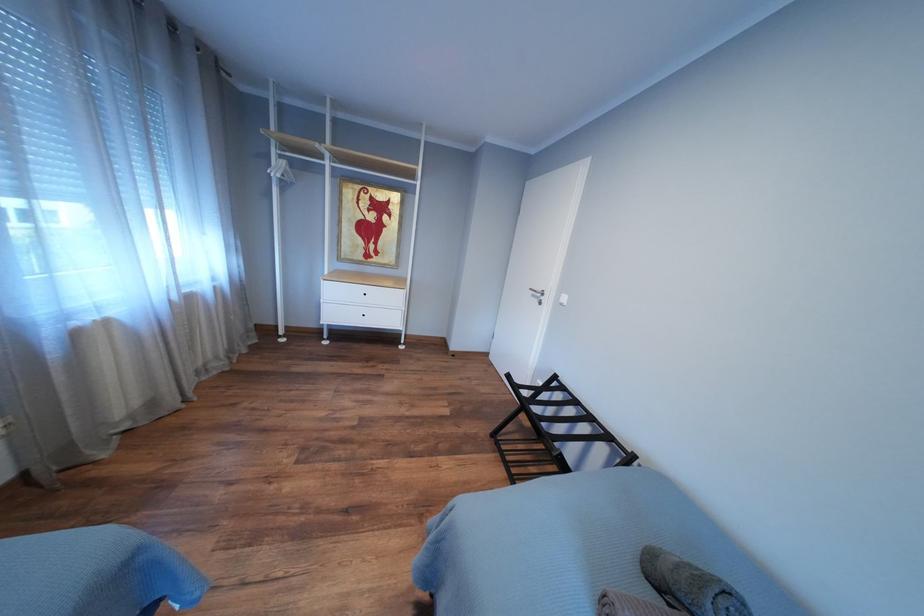
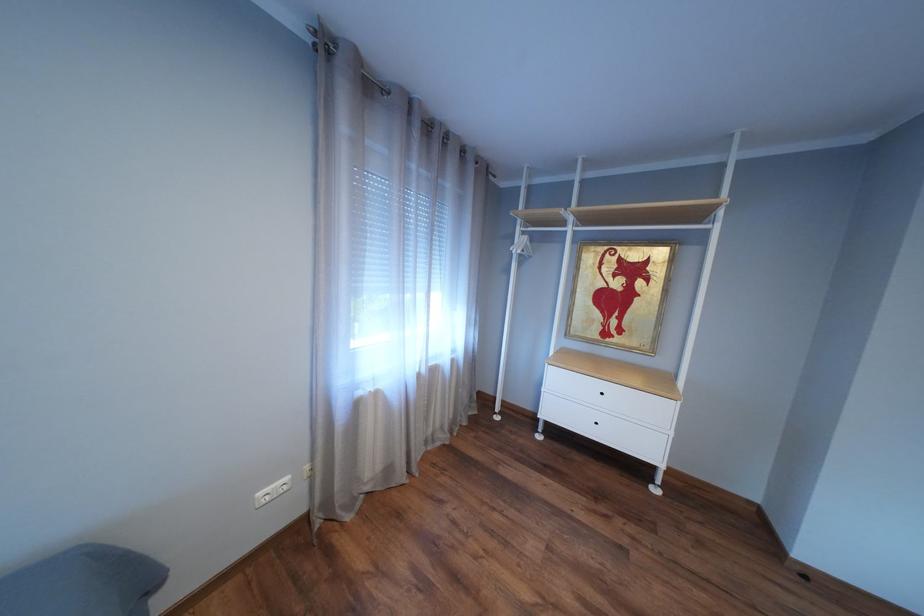
Question: Based on the continuous images, in which direction is the camera rotating? Reply with the corresponding letter.

Choices:
 (A) Left
 (B) Right
 (C) Up
 (D) Down

Answer: (A)